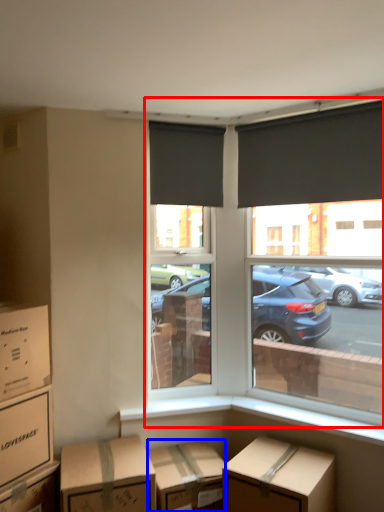
Question: Which of the following is the closest to the observer, window (highlighted by a red box) or cardboard box (highlighted by a blue box)?

Choices:
 (A) window
 (B) cardboard box

Answer: (B)